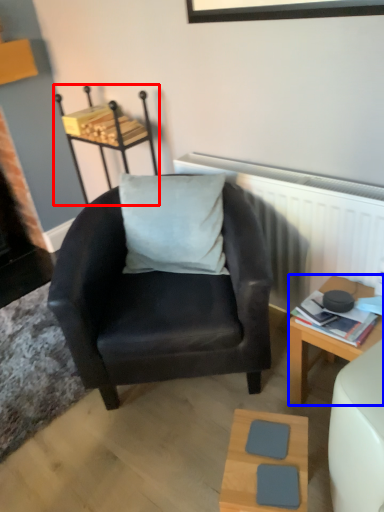
Question: Which object is closer to the camera taking this photo, stool (highlighted by a red box) or desk (highlighted by a blue box)?

Choices:
 (A) stool
 (B) desk

Answer: (B)